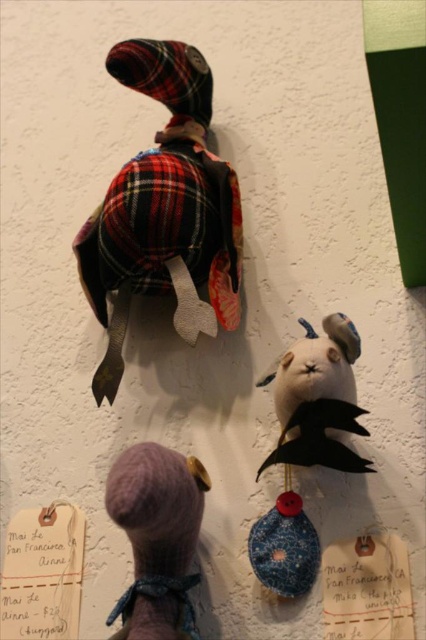
Question: Which point is farther from the camera taking this photo?

Choices:
 (A) (288, 432)
 (B) (126, 593)

Answer: (A)

Question: Is plaid fabric duck at upper left wider than felt rabbit at center?

Choices:
 (A) yes
 (B) no

Answer: (A)

Question: Is plaid fabric duck at upper left wider than fuzzy pink doll at lower left?

Choices:
 (A) no
 (B) yes

Answer: (B)

Question: Is plaid fabric duck at upper left thinner than felt rabbit at center?

Choices:
 (A) no
 (B) yes

Answer: (A)

Question: Which of the following is the farthest from the observer?

Choices:
 (A) plaid fabric duck at upper left
 (B) felt rabbit at center
 (C) fuzzy pink doll at lower left

Answer: (A)

Question: Which is nearer to the plaid fabric duck at upper left?

Choices:
 (A) fuzzy pink doll at lower left
 (B) felt rabbit at center

Answer: (B)